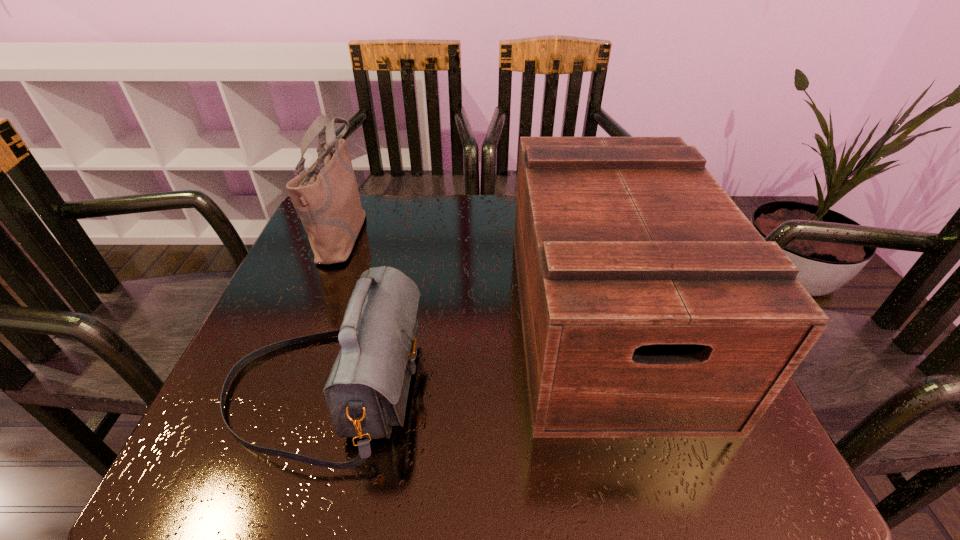
Identify the location of vacant area that lies between the shortest object and the taller shoulder bag. (334, 311).

Select which object appears as the second closest to the box. Please provide its 2D coordinates. Your answer should be formatted as a tuple, i.e. [(x, y)], where the tuple contains the x and y coordinates of a point satisfying the conditions above.

[(326, 197)]

Locate which object ranks second in proximity to the shortest object. Please provide its 2D coordinates. Your answer should be formatted as a tuple, i.e. [(x, y)], where the tuple contains the x and y coordinates of a point satisfying the conditions above.

[(651, 307)]

Find the location of a particular element. This screenshot has height=540, width=960. vacant position in the image that satisfies the following two spatial constraints: 1. on the back side of the box; 2. on the front-facing side of the taller shoulder bag is located at coordinates (580, 234).

Find the location of a particular element. free space that satisfies the following two spatial constraints: 1. on the back side of the nearer shoulder bag; 2. on the front-facing side of the farther shoulder bag is located at coordinates (372, 234).

What are the coordinates of `vacant region that satisfies the following two spatial constraints: 1. on the front-facing side of the farther shoulder bag; 2. on the right side of the rightmost object` in the screenshot? It's located at (310, 316).

Image resolution: width=960 pixels, height=540 pixels. Find the location of `vacant space that satisfies the following two spatial constraints: 1. on the front-facing side of the farther shoulder bag; 2. on the left side of the rightmost object`. vacant space that satisfies the following two spatial constraints: 1. on the front-facing side of the farther shoulder bag; 2. on the left side of the rightmost object is located at coordinates (310, 316).

Where is `free location that satisfies the following two spatial constraints: 1. on the front-facing side of the farther shoulder bag; 2. on the left side of the nearer shoulder bag`? free location that satisfies the following two spatial constraints: 1. on the front-facing side of the farther shoulder bag; 2. on the left side of the nearer shoulder bag is located at coordinates (281, 388).

Locate an element on the screen. The height and width of the screenshot is (540, 960). vacant point that satisfies the following two spatial constraints: 1. on the front-facing side of the rightmost object; 2. on the left side of the farther shoulder bag is located at coordinates (310, 316).

Find the location of `free space that satisfies the following two spatial constraints: 1. on the front-facing side of the taller shoulder bag; 2. on the left side of the box`. free space that satisfies the following two spatial constraints: 1. on the front-facing side of the taller shoulder bag; 2. on the left side of the box is located at coordinates (310, 316).